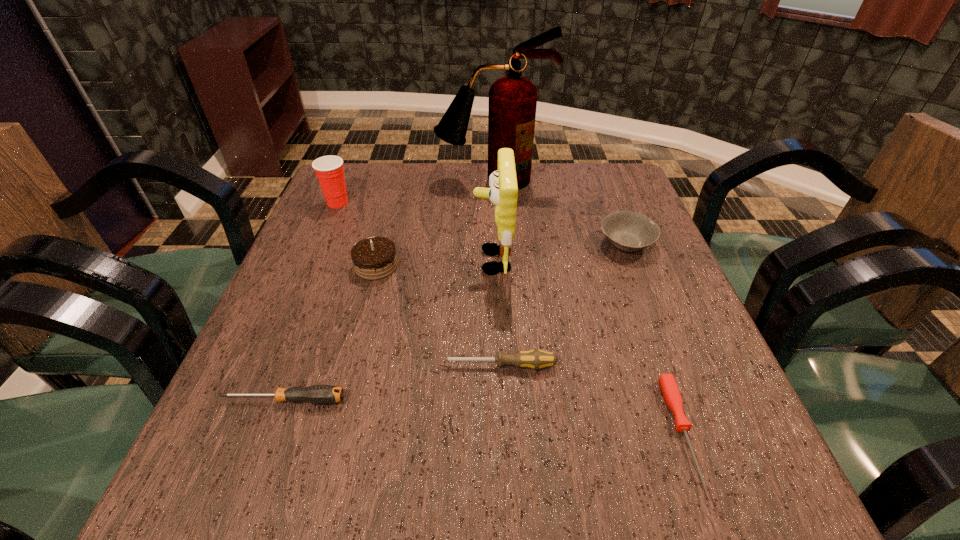
Where is `vacant region located 0.050m at the tip of the second screwdriver from left to right`? This screenshot has width=960, height=540. vacant region located 0.050m at the tip of the second screwdriver from left to right is located at coordinates (415, 366).

The height and width of the screenshot is (540, 960). Find the location of `vacant point located at the tip of the second screwdriver from left to right`. vacant point located at the tip of the second screwdriver from left to right is located at coordinates 403,366.

Find the location of a particular element. Image resolution: width=960 pixels, height=540 pixels. vacant region located on the back of the leftmost screwdriver is located at coordinates (306, 341).

Find the location of `fire extinguisher present at the far edge`. fire extinguisher present at the far edge is located at coordinates click(512, 104).

Locate an element on the screen. This screenshot has height=540, width=960. Dixie cup that is at the far edge is located at coordinates (329, 169).

The width and height of the screenshot is (960, 540). Find the location of `object that is at the near edge`. object that is at the near edge is located at coordinates (671, 393).

Find the location of a particular element. Dixie cup present at the left edge is located at coordinates (329, 169).

Where is `chocolate cake that is at the left edge`? The width and height of the screenshot is (960, 540). chocolate cake that is at the left edge is located at coordinates [x=374, y=258].

Identify the location of screwdriver situated at the left edge. This screenshot has width=960, height=540. (317, 394).

Locate an element on the screen. This screenshot has width=960, height=540. bowl at the right edge is located at coordinates (629, 231).